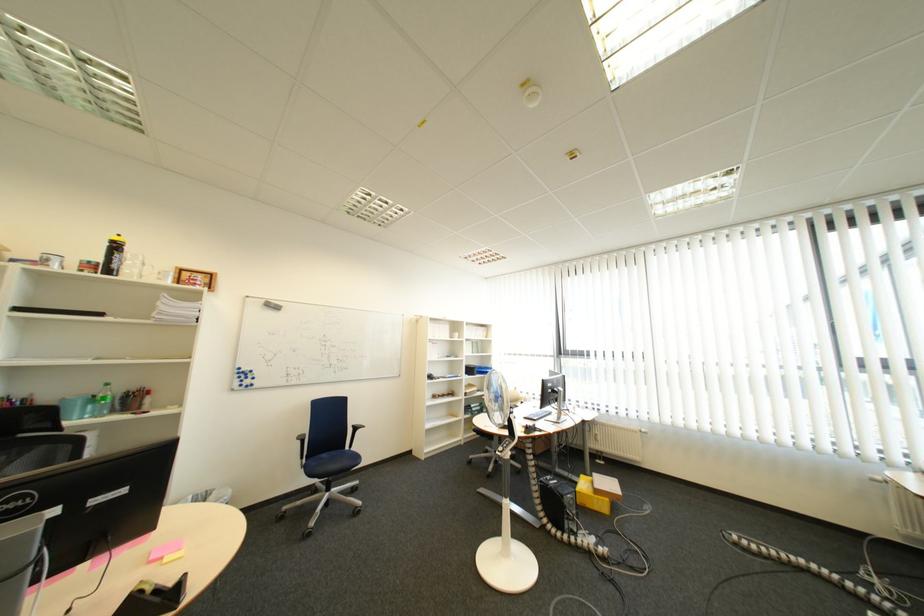
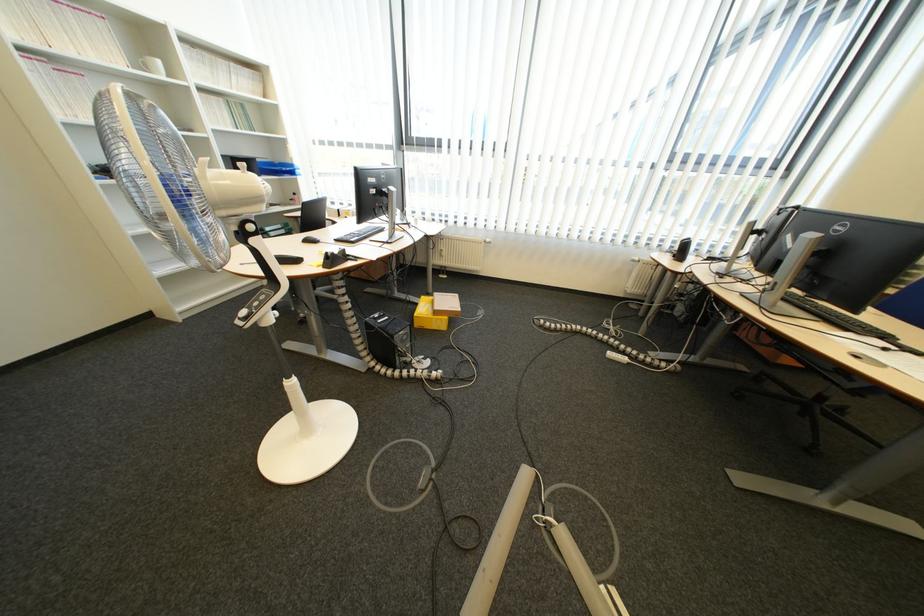
Locate, in the second image, the point that corresponds to (x=476, y=445) in the first image.

(277, 285)